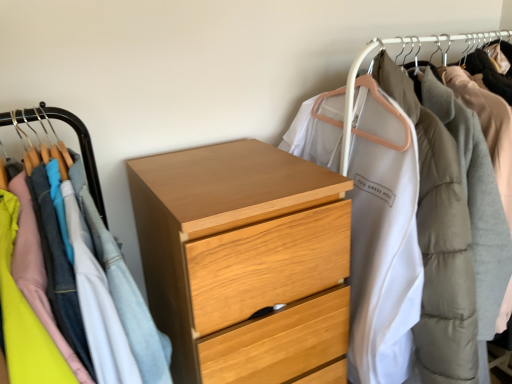
Question: From a real-world perspective, is light wood chest of drawers at center below white matte coat at upper right, which is the 1th closet in right-to-left order?

Choices:
 (A) no
 (B) yes

Answer: (B)

Question: Would you say light wood chest of drawers at center is a long distance from white matte coat at upper right, the 2th closet viewed from the left?

Choices:
 (A) yes
 (B) no

Answer: (B)

Question: Considering the relative positions of light wood chest of drawers at center and white matte coat at upper right, the 2th closet viewed from the left, in the image provided, is light wood chest of drawers at center to the right of white matte coat at upper right, the 2th closet viewed from the left, from the viewer's perspective?

Choices:
 (A) yes
 (B) no

Answer: (B)

Question: Does light wood chest of drawers at center appear on the left side of white matte coat at upper right, which is the 1th closet in right-to-left order?

Choices:
 (A) no
 (B) yes

Answer: (B)

Question: Considering the relative sizes of light wood chest of drawers at center and white matte coat at upper right, which is the 1th closet in right-to-left order, in the image provided, is light wood chest of drawers at center taller than white matte coat at upper right, which is the 1th closet in right-to-left order,?

Choices:
 (A) no
 (B) yes

Answer: (B)

Question: Is light wood chest of drawers at center smaller than white matte coat at upper right, the 2th closet viewed from the left?

Choices:
 (A) no
 (B) yes

Answer: (A)

Question: Is white matte coat at upper right, which is the 1th closet in right-to-left order, shorter than wooden chest of drawers at center, which is the first closet from left to right?

Choices:
 (A) no
 (B) yes

Answer: (A)

Question: Can you confirm if white matte coat at upper right, the 2th closet viewed from the left, is wider than wooden chest of drawers at center, which is the first closet from left to right?

Choices:
 (A) yes
 (B) no

Answer: (A)

Question: From a real-world perspective, is white matte coat at upper right, which is the 1th closet in right-to-left order, on top of wooden chest of drawers at center, which is the first closet from left to right?

Choices:
 (A) yes
 (B) no

Answer: (A)

Question: Is white matte coat at upper right, which is the 1th closet in right-to-left order, to the right of wooden chest of drawers at center, which is the first closet from left to right, from the viewer's perspective?

Choices:
 (A) yes
 (B) no

Answer: (A)

Question: Is white matte coat at upper right, the 2th closet viewed from the left, to the left of wooden chest of drawers at center, which ranks as the second closet in right-to-left order, from the viewer's perspective?

Choices:
 (A) yes
 (B) no

Answer: (B)

Question: Would you say wooden chest of drawers at center, which is the first closet from left to right, contains white matte coat at upper right, the 2th closet viewed from the left?

Choices:
 (A) yes
 (B) no

Answer: (B)